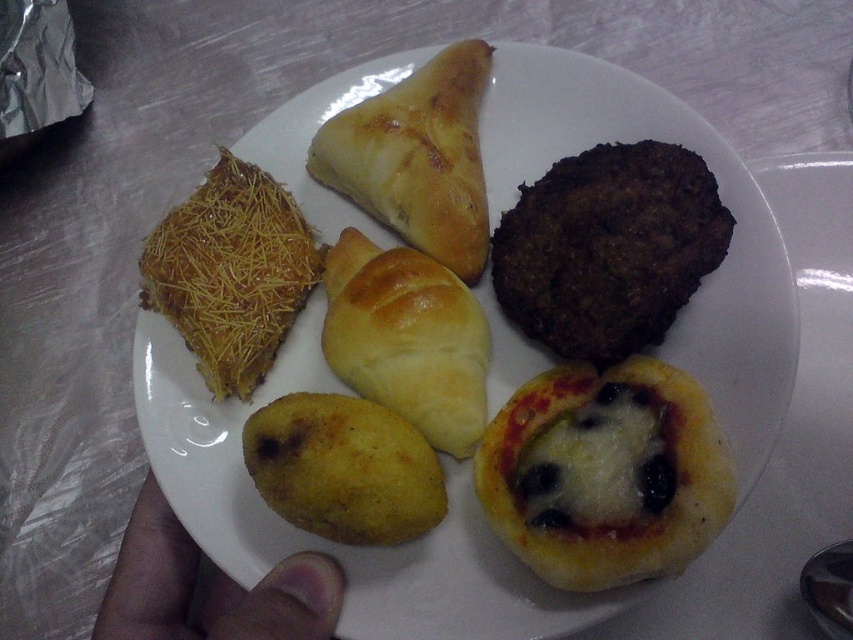
You are a food critic evaluating the plate of food. You notice the golden crispy pastry at upper left and the brown skin at lower left. Which of these two items is thinner?

The golden crispy pastry at upper left is thinner than the brown skin at lower left.

You are trying to place a napkin on the plate to cover the golden crispy pastry at upper left. Based on its position, where should you place the napkin relative to the other items on the plate?

The golden crispy pastry at upper left is located at point (231, 273), so you should place the napkin slightly to the upper left of the center of the plate to cover it without covering the other pastries.